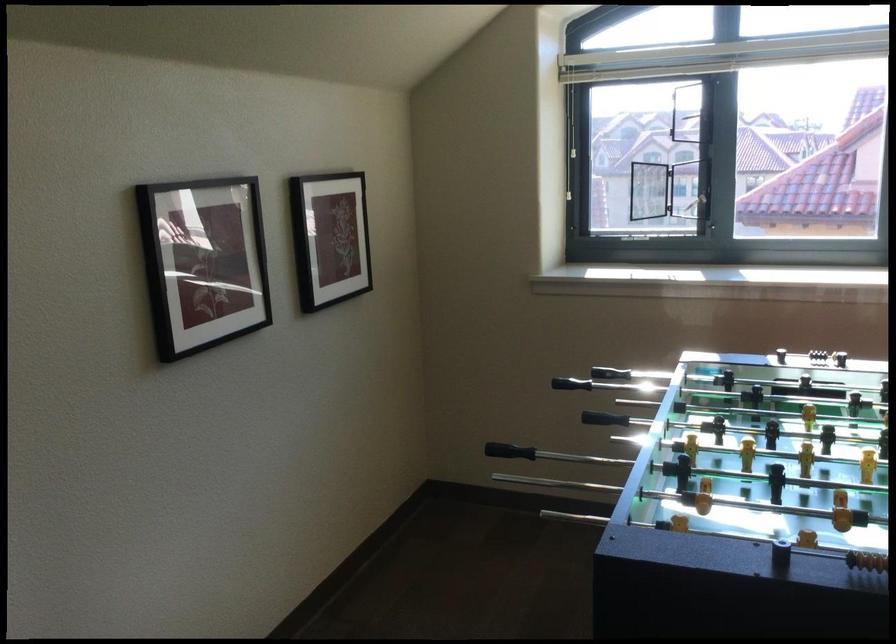
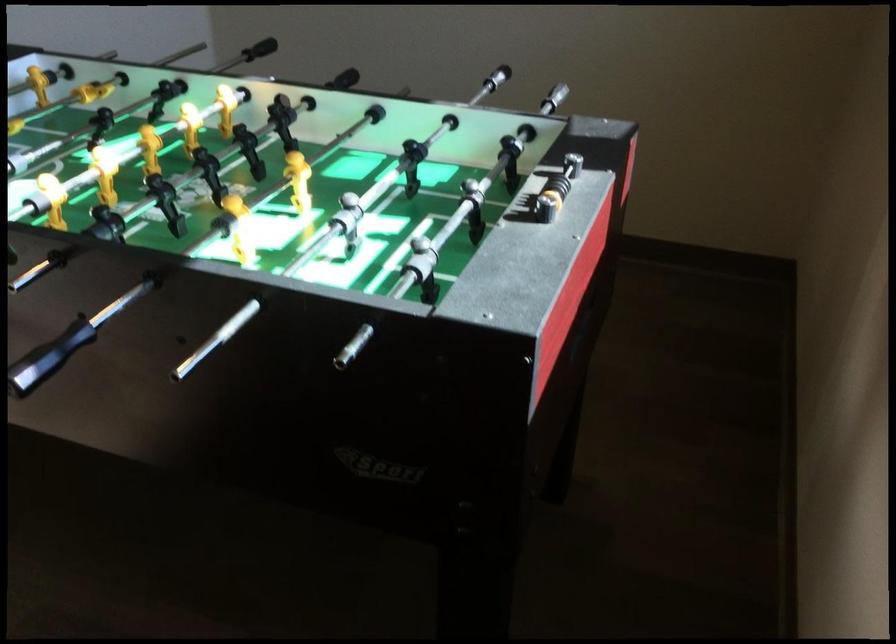
Question: I am providing you with two images of the same scene from different viewpoints. Which of the following objects are not visible in image2?

Choices:
 (A) foosball rod handle
 (B) white round magnet
 (C) black foosball handle
 (D) scoring beads

Answer: (C)